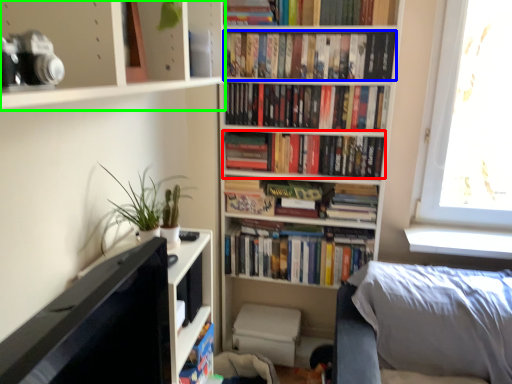
Question: Which is farther away from book (highlighted by a red box)? book (highlighted by a blue box) or shelf (highlighted by a green box)?

Choices:
 (A) book
 (B) shelf

Answer: (B)